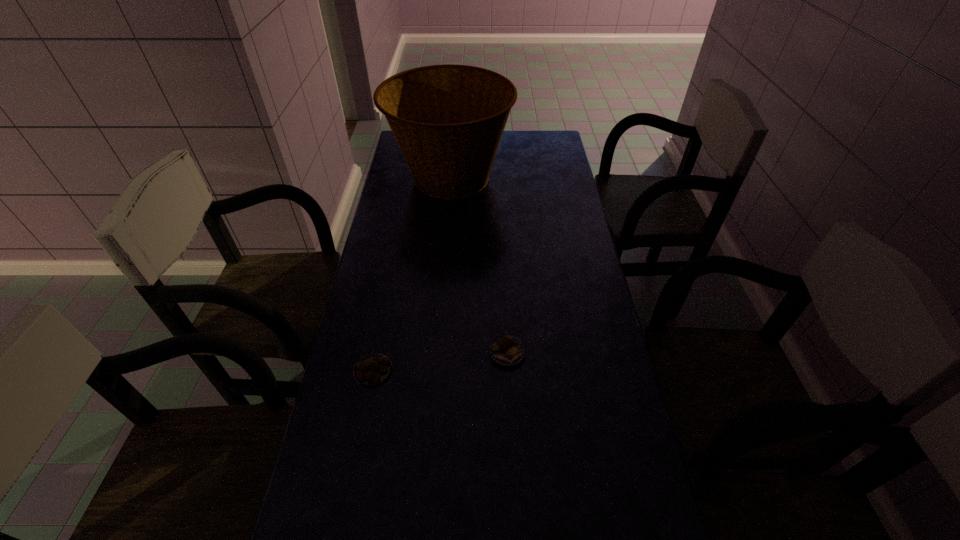
Locate an element on the screen. The height and width of the screenshot is (540, 960). free spot between the second shortest object and the farthest object is located at coordinates (479, 266).

Find the location of a particular element. This screenshot has width=960, height=540. vacant point located between the farthest object and the shortest object is located at coordinates (412, 274).

What are the coordinates of `vacant area between the shorter pastry and the right pastry` in the screenshot? It's located at (441, 362).

Locate an element on the screen. The image size is (960, 540). free space between the second tallest object and the left pastry is located at coordinates (441, 362).

Identify the location of free space between the farthest object and the left pastry. The image size is (960, 540). (412, 274).

Locate an element on the screen. empty space that is in between the shortest object and the second shortest object is located at coordinates (441, 362).

Identify which object is located as the second nearest to the tallest object. Please provide its 2D coordinates. Your answer should be formatted as a tuple, i.e. [(x, y)], where the tuple contains the x and y coordinates of a point satisfying the conditions above.

[(373, 369)]

This screenshot has height=540, width=960. In order to click on object that is the second closest one to the taller pastry in this screenshot , I will do `click(448, 120)`.

Find the location of a particular element. The width and height of the screenshot is (960, 540). vacant space that satisfies the following two spatial constraints: 1. on the back side of the taller pastry; 2. on the left side of the shorter pastry is located at coordinates (376, 353).

Image resolution: width=960 pixels, height=540 pixels. What are the coordinates of `free space that satisfies the following two spatial constraints: 1. on the back side of the right pastry; 2. on the left side of the shorter pastry` in the screenshot? It's located at (376, 353).